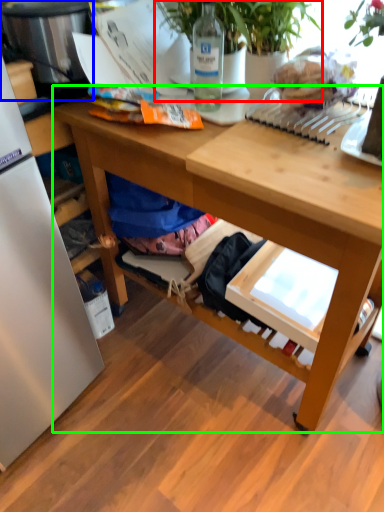
Question: Considering the real-world distances, which object is closest to houseplant (highlighted by a red box)? appliance (highlighted by a blue box) or desk (highlighted by a green box).

Choices:
 (A) appliance
 (B) desk

Answer: (A)